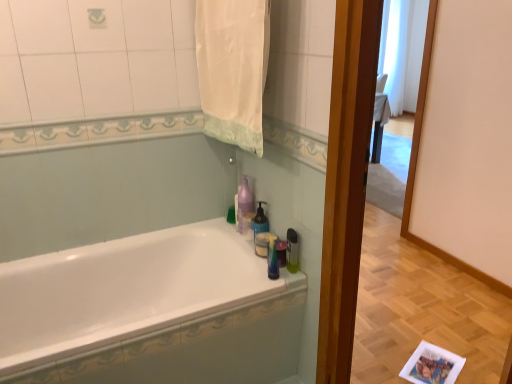
Question: From the image's perspective, is translucent plastic soap dispenser at upper center beneath white glossy bathtub at center?

Choices:
 (A) yes
 (B) no

Answer: (B)

Question: Does translucent plastic soap dispenser at upper center have a greater height compared to white glossy bathtub at center?

Choices:
 (A) no
 (B) yes

Answer: (A)

Question: Does translucent plastic soap dispenser at upper center have a larger size compared to white glossy bathtub at center?

Choices:
 (A) no
 (B) yes

Answer: (A)

Question: Is translucent plastic soap dispenser at upper center further to the viewer compared to white glossy bathtub at center?

Choices:
 (A) no
 (B) yes

Answer: (B)

Question: Are translucent plastic soap dispenser at upper center and white glossy bathtub at center far apart?

Choices:
 (A) yes
 (B) no

Answer: (B)

Question: Does translucent plastic soap dispenser at upper center appear on the left side of white glossy bathtub at center?

Choices:
 (A) no
 (B) yes

Answer: (A)

Question: Would you consider purple glossy bottle at upper center to be distant from white fabric towel at upper center?

Choices:
 (A) yes
 (B) no

Answer: (B)

Question: Is purple glossy bottle at upper center oriented away from white fabric towel at upper center?

Choices:
 (A) yes
 (B) no

Answer: (B)

Question: From the image's perspective, is purple glossy bottle at upper center on white fabric towel at upper center?

Choices:
 (A) yes
 (B) no

Answer: (B)

Question: Is purple glossy bottle at upper center beside white fabric towel at upper center?

Choices:
 (A) no
 (B) yes

Answer: (A)

Question: From a real-world perspective, is purple glossy bottle at upper center located higher than white fabric towel at upper center?

Choices:
 (A) no
 (B) yes

Answer: (A)

Question: Is purple glossy bottle at upper center located outside white fabric towel at upper center?

Choices:
 (A) yes
 (B) no

Answer: (A)

Question: From the image's perspective, is translucent plastic soap dispenser at right under white fabric towel at upper center?

Choices:
 (A) no
 (B) yes

Answer: (B)